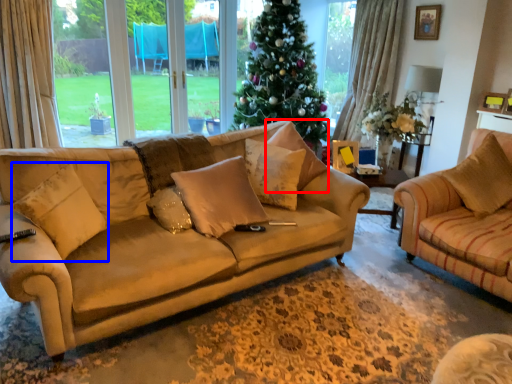
Question: Among these objects, which one is farthest to the camera, pillow (highlighted by a red box) or pillow (highlighted by a blue box)?

Choices:
 (A) pillow
 (B) pillow

Answer: (A)